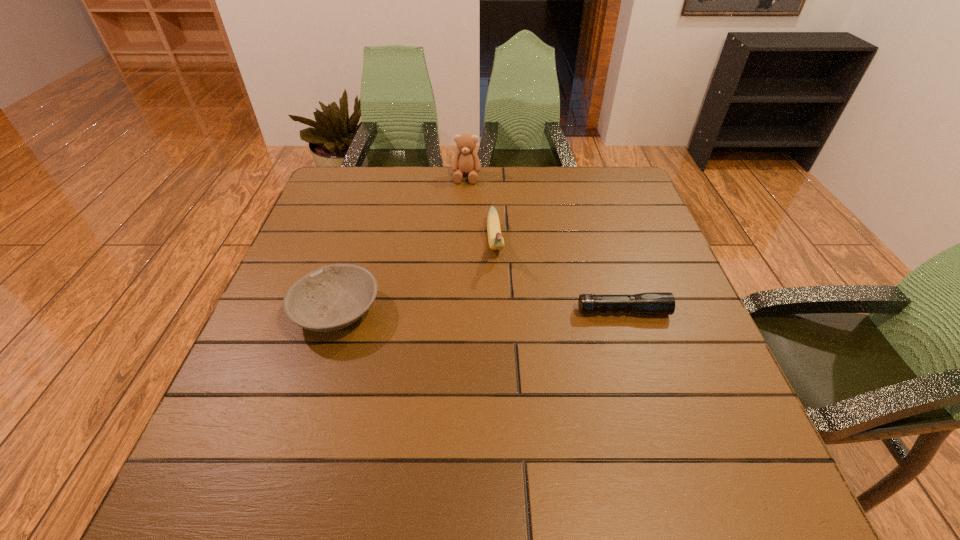
At what (x,y) coordinates should I click in order to perform the action: click on free space located on the face of the farthest object. Please return your answer as a coordinate pair (x, y). The width and height of the screenshot is (960, 540). Looking at the image, I should click on (458, 234).

Identify the location of vacant space located 0.060m on the face of the farthest object. (464, 196).

This screenshot has height=540, width=960. I want to click on blank space located 0.330m at the stem of the second farthest object, so click(x=511, y=387).

This screenshot has width=960, height=540. What are the coordinates of `free space located at the stem of the second farthest object` in the screenshot? It's located at (498, 284).

Where is `blank area located at the stem of the second farthest object`? The image size is (960, 540). blank area located at the stem of the second farthest object is located at coordinates (500, 303).

This screenshot has height=540, width=960. Find the location of `object located at the far edge`. object located at the far edge is located at coordinates [x=466, y=161].

I want to click on object that is at the left edge, so coord(332,297).

The width and height of the screenshot is (960, 540). Find the location of `object that is positioned at the right edge`. object that is positioned at the right edge is located at coordinates (655, 303).

Locate an element on the screen. free space at the far edge is located at coordinates (494, 174).

Identify the location of vacant space at the near edge of the desktop. (319, 402).